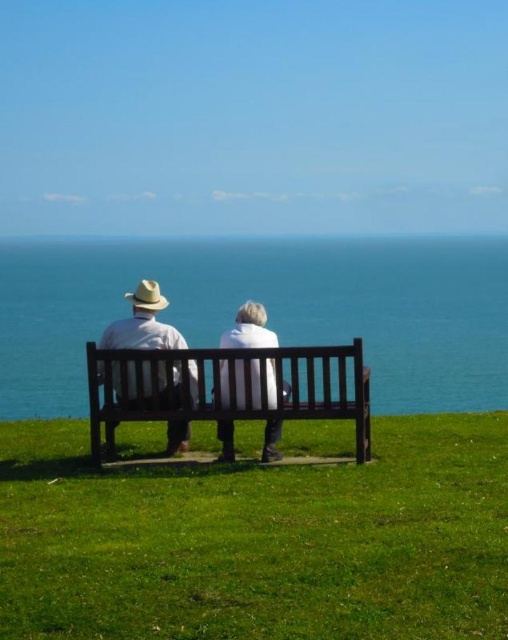
You are planning to take a photo of the blue water at center and the white matte jacket at center. Which object should you focus on first if you want to capture both in the same frame without moving the camera?

The blue water at center is wider than the white matte jacket at center, so you should focus on the blue water at center first to ensure it fits within the frame.

You are standing at the origin point of the coordinate system. You see two points labeled as point (185, 440) and point (238, 316). Which point is located behind the other?

Point (185, 440) is behind point (238, 316).

You are standing at the origin point of the image coordinate system, which is the bottom left corner. The image has a width of 1 unit and height of 1 unit. You want to locate the matte white shirt at center. What are its coordinates?

The coordinates of the matte white shirt at center are at point (142,323).